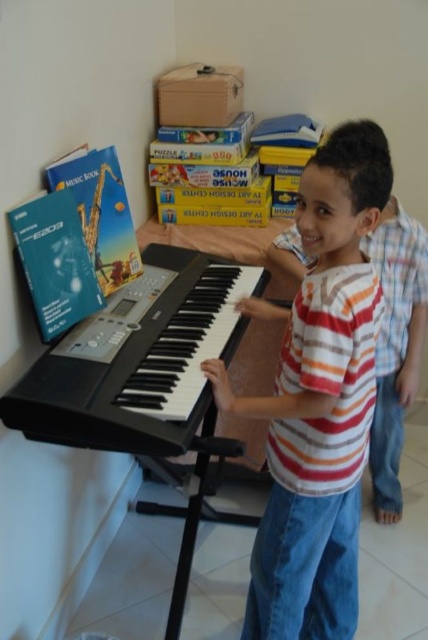
You are a tailor measuring the height of clothing items in a room. The scene has a striped cotton shirt at center and a black matte keyboard at center. Which item is taller?

The striped cotton shirt at center is taller than the black matte keyboard at center.

You are a photographer standing in front of the scene. You want to take a closeup photo of the striped cotton shirt at center. Considering the distance between you and the shirt, is it possible to capture the entire shirt in the photo without moving closer?

The striped cotton shirt at center is 3.44 feet away from the viewer. Depending on the camera lens and zoom capabilities, it might be possible to capture the entire shirt without moving closer, but this would require a wide angle or zoom adjustment to ensure the entire shirt fits within the frame.

You are a photographer trying to capture a closeup of the black matte keyboard at center without including the striped cotton shirt at center in the frame. Given their current distance, is this possible?

The striped cotton shirt at center and black matte keyboard at center are 11.85 inches apart. Since the distance between them is sufficient, it is possible to frame the photo so that only the black matte keyboard at center is visible while excluding the striped cotton shirt at center.